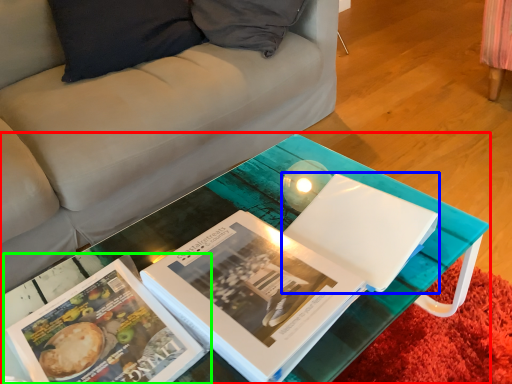
Question: Estimate the real-world distances between objects in this image. Which object is closer to table (highlighted by a red box), paperback book (highlighted by a blue box) or book (highlighted by a green box)?

Choices:
 (A) paperback book
 (B) book

Answer: (A)